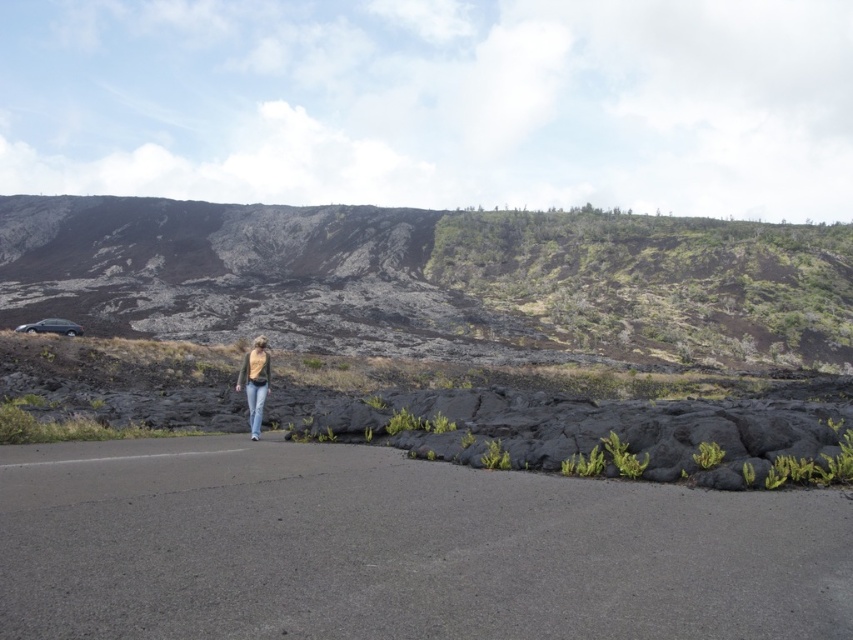
Between point (260, 400) and point (74, 330), which one is positioned in front?

Positioned in front is point (260, 400).

Is denim at center behind shiny silver car at lower left?

No, denim at center is closer to the viewer.

The height and width of the screenshot is (640, 853). Describe the element at coordinates (254, 404) in the screenshot. I see `denim at center` at that location.

I want to click on denim at center, so click(254, 404).

In the scene shown: Is volcanic rock at upper left smaller than denim pants at center?

No.

How distant is volcanic rock at upper left from denim pants at center?

volcanic rock at upper left and denim pants at center are 323.93 feet apart from each other.

Where is `volcanic rock at upper left`? The image size is (853, 640). volcanic rock at upper left is located at coordinates (433, 276).

Find the location of a particular element. volcanic rock at upper left is located at coordinates (433, 276).

Can you confirm if asphalt road at center is positioned above denim at center?

No, asphalt road at center is not above denim at center.

This screenshot has width=853, height=640. What do you see at coordinates (398, 548) in the screenshot? I see `asphalt road at center` at bounding box center [398, 548].

Between point (346, 547) and point (248, 385), which one is positioned in front?

Positioned in front is point (346, 547).

Where is `asphalt road at center`? The width and height of the screenshot is (853, 640). asphalt road at center is located at coordinates (398, 548).